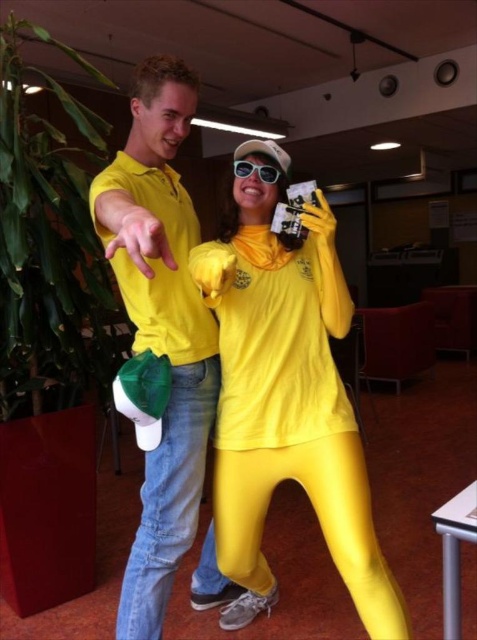
Is point (350, 541) positioned in front of point (188, 392)?

Yes, it is in front of point (188, 392).

I want to click on matte yellow jumpsuit at center, so click(x=287, y=397).

Locate an element on the screen. This screenshot has height=640, width=477. matte yellow jumpsuit at center is located at coordinates (287, 397).

Which is in front, point (174, 544) or point (261, 166)?

Point (261, 166) is in front.

Can you confirm if matte yellow shirt at left is smaller than sunglasses at center?

Actually, matte yellow shirt at left might be larger than sunglasses at center.

Based on the photo, who is more distant from viewer, (x=136, y=74) or (x=235, y=168)?

Point (x=235, y=168)

Identify the location of matte yellow shirt at left. (161, 326).

Can you confirm if matte yellow jumpsuit at center is bigger than sunglasses at center?

Yes, matte yellow jumpsuit at center is bigger than sunglasses at center.

Is point (352, 577) more distant than point (270, 168)?

No, (352, 577) is closer to viewer.

The image size is (477, 640). In order to click on matte yellow jumpsuit at center in this screenshot , I will do `click(287, 397)`.